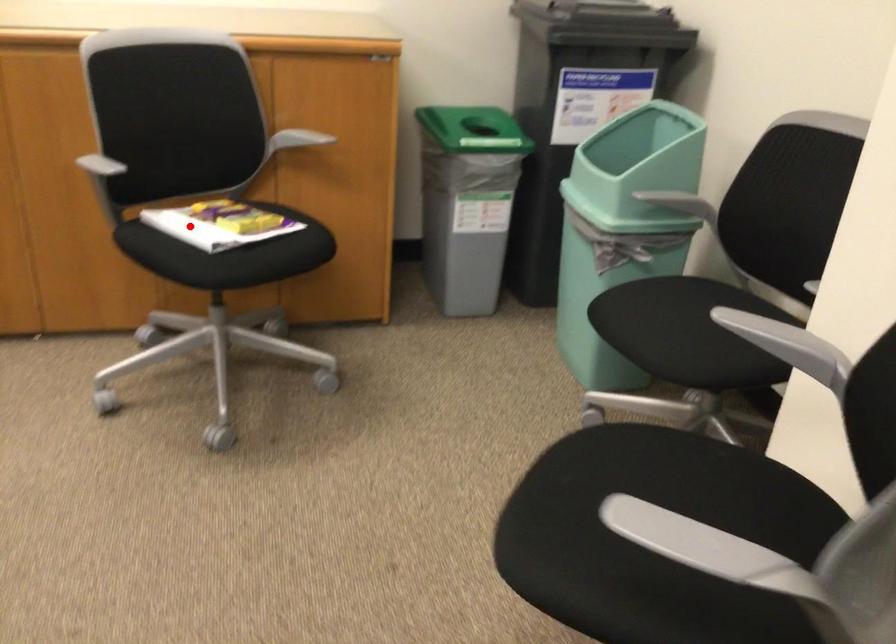
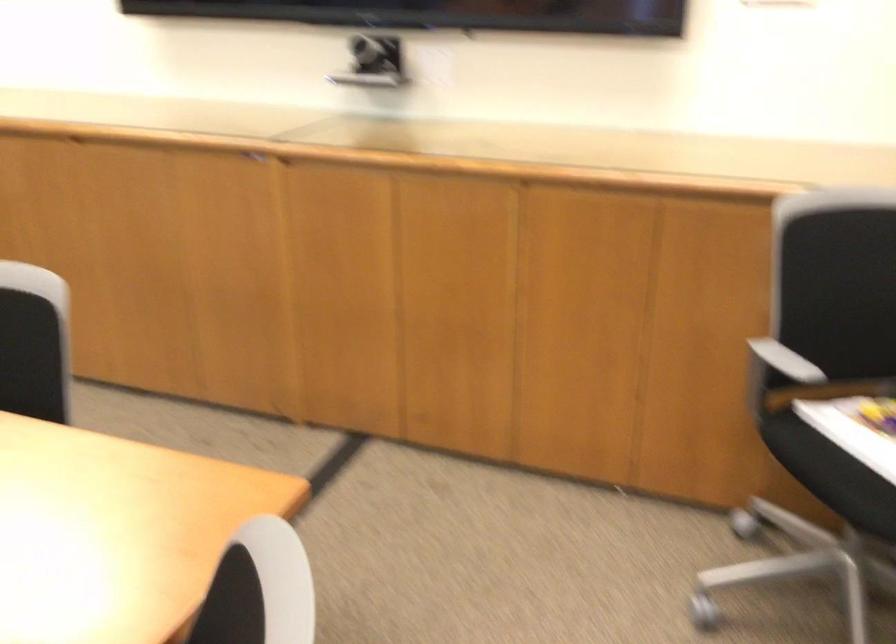
Where in the second image is the point corresponding to the highlighted location from the first image?

(857, 442)